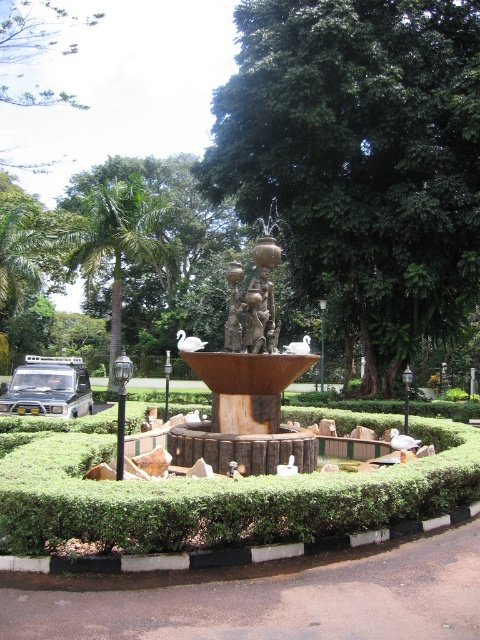
You are standing in the garden looking at the fountain. Which object is higher up between the green leafy tree at center and the green leafy hedge at center?

The green leafy tree at center is higher up than the green leafy hedge at center.

You are standing in the garden and want to take a photo of the rusty metal fountain at center without the green leafy tree at left appearing in the background. Is the fountain positioned in a way that allows this?

The rusty metal fountain at center is in front of the green leafy tree at left, so if you position yourself so that the fountain is between you and the tree, the tree will not be visible in the background. However, if the tree is behind the fountain from your viewpoint, the fountain itself might block the tree. Wait, the description says the fountain is in front of the tree, meaning the tree is behind the fountain. Therefore, to avoid the tree in the background, you should ensure the fountain is between you

You are standing in the garden and want to locate the point at coordinates (247, 385). Based on the scene description, where exactly is this point located?

The point at coordinates (247, 385) is located on the rusty metal fountain at center.